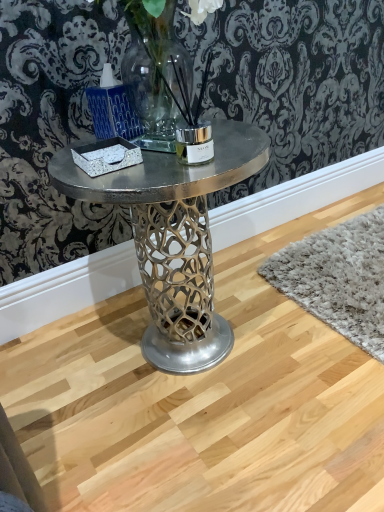
Question: Relative to matte blue candle holder at upper left, is metallic silver table at center in front or behind?

Choices:
 (A) front
 (B) behind

Answer: (B)

Question: Do you think metallic silver table at center is within matte blue candle holder at upper left, or outside of it?

Choices:
 (A) inside
 (B) outside

Answer: (B)

Question: Considering the positions of point (77, 178) and point (112, 120), is point (77, 178) closer or farther from the camera than point (112, 120)?

Choices:
 (A) farther
 (B) closer

Answer: (B)

Question: In the image, is matte blue candle holder at upper left positioned in front of or behind metallic silver table at center?

Choices:
 (A) front
 (B) behind

Answer: (A)

Question: Based on their positions, is matte blue candle holder at upper left located to the left or right of metallic silver table at center?

Choices:
 (A) left
 (B) right

Answer: (A)

Question: From the image's perspective, relative to metallic silver table at center, is matte blue candle holder at upper left above or below?

Choices:
 (A) below
 (B) above

Answer: (B)

Question: Does point (120, 99) appear closer or farther from the camera than point (142, 248)?

Choices:
 (A) closer
 (B) farther

Answer: (A)